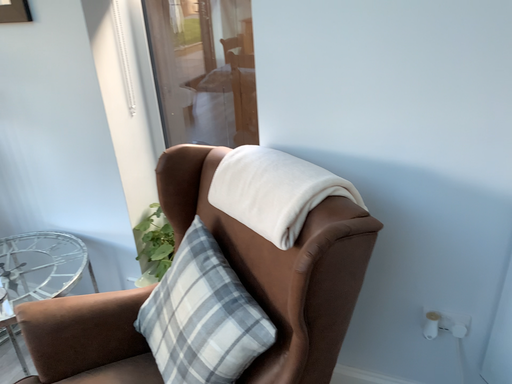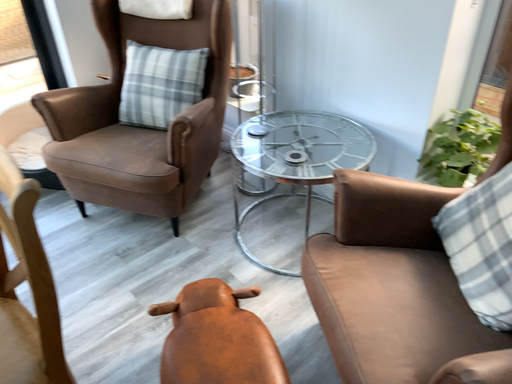
Question: Which way did the camera rotate in the video?

Choices:
 (A) rotated left
 (B) rotated right

Answer: (A)